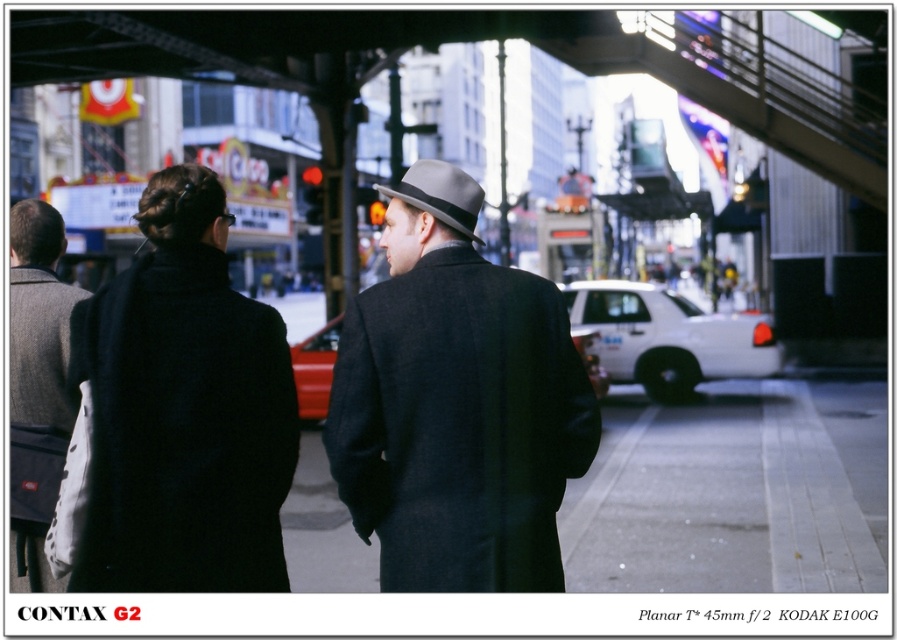
You are standing on the sidewalk in the urban street scene and want to walk towards the two points marked in the image. Which point, point (484, 477) or point (468, 221), will you reach first?

Point (484, 477) is closer to the viewer than point (468, 221), so you will reach point (484, 477) first.

You are a photographer trying to capture a clear shot of the black wool coat at left without the matte gray coat at center blocking it. What should you do?

The black wool coat at left is behind the matte gray coat at center, so you should move to the side to get a clear view of the black wool coat at left without obstruction.